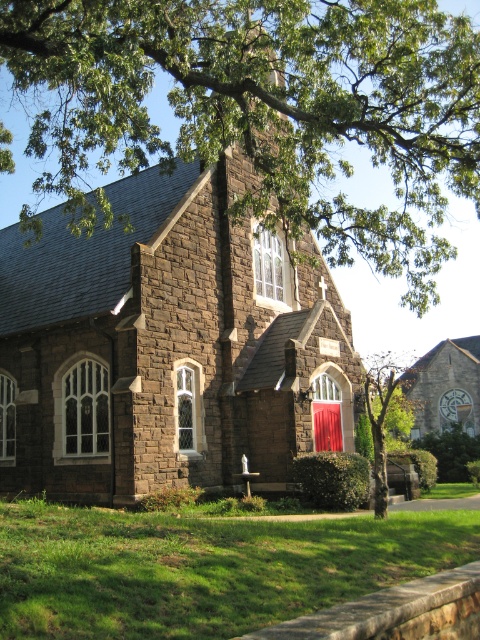
Question: Can you confirm if brown stone chapel at center is positioned below green leafy tree at center?

Choices:
 (A) yes
 (B) no

Answer: (B)

Question: Which object is positioned farthest from the green leafy tree at upper center?

Choices:
 (A) green leafy tree at center
 (B) brown stone chapel at center

Answer: (A)

Question: Considering the relative positions of green leafy tree at upper center and green leafy tree at center in the image provided, where is green leafy tree at upper center located with respect to green leafy tree at center?

Choices:
 (A) above
 (B) below

Answer: (A)

Question: Among these points, which one is farthest from the camera?

Choices:
 (A) (373, 387)
 (B) (116, 60)
 (C) (56, 301)

Answer: (A)

Question: Where is green leafy tree at upper center located in relation to green leafy tree at center in the image?

Choices:
 (A) left
 (B) right

Answer: (A)

Question: Estimate the real-world distances between objects in this image. Which object is closer to the green leafy tree at upper center?

Choices:
 (A) brown stone chapel at center
 (B) green leafy tree at center

Answer: (A)